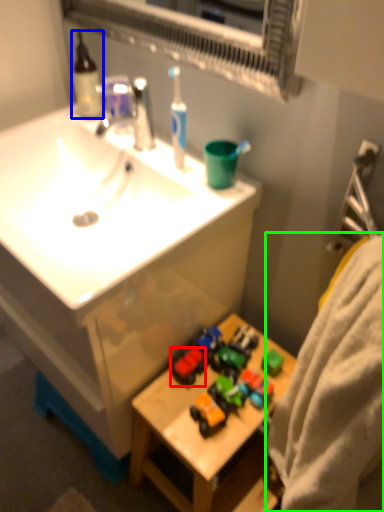
Question: Estimate the real-world distances between objects in this image. Which object is closer to toy (highlighted by a red box), bottle (highlighted by a blue box) or bath towel (highlighted by a green box)?

Choices:
 (A) bottle
 (B) bath towel

Answer: (B)